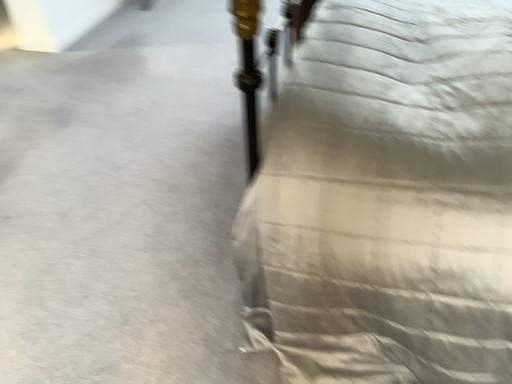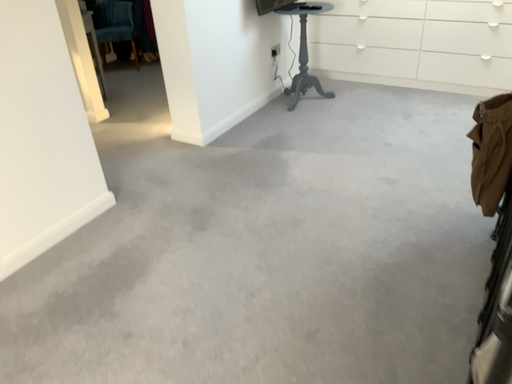
Question: Which way did the camera rotate in the video?

Choices:
 (A) rotated left
 (B) rotated right

Answer: (A)